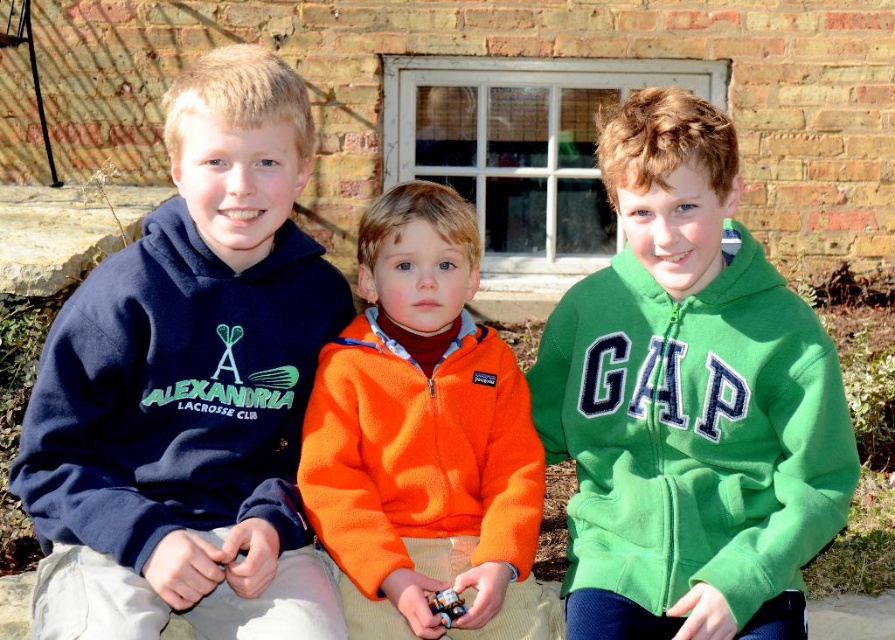
Question: Is navy fleece hoodie at left in front of orange fleece jacket at center?

Choices:
 (A) no
 (B) yes

Answer: (B)

Question: Which object is closer to the camera taking this photo?

Choices:
 (A) orange fleece jacket at center
 (B) navy fleece hoodie at left

Answer: (B)

Question: Does navy fleece hoodie at left appear on the left side of orange fleece jacket at center?

Choices:
 (A) no
 (B) yes

Answer: (B)

Question: Is navy fleece hoodie at left positioned in front of green fleece jacket at center?

Choices:
 (A) no
 (B) yes

Answer: (B)

Question: Which point is farther to the camera?

Choices:
 (A) (248, 496)
 (B) (310, 426)

Answer: (B)

Question: Estimate the real-world distances between objects in this image. Which object is closer to the navy fleece hoodie at left?

Choices:
 (A) green fleece jacket at center
 (B) orange fleece jacket at center

Answer: (B)